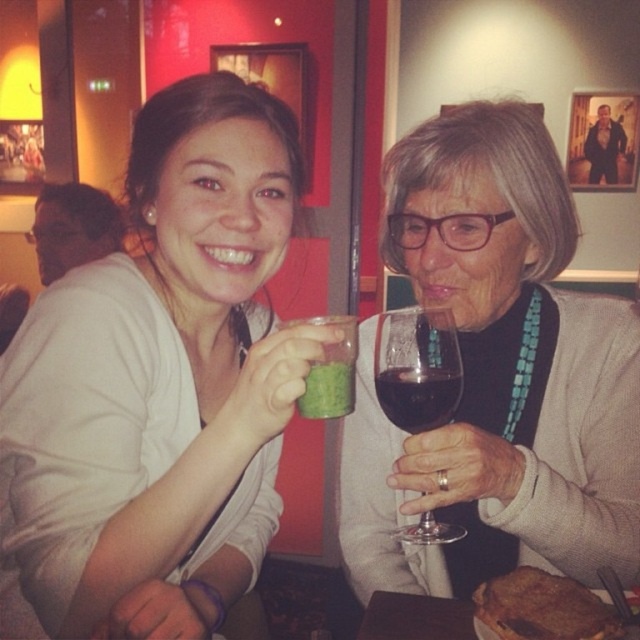
Question: Considering the real-world distances, which object is farthest from the wooden table at lower center?

Choices:
 (A) transparent glass at upper right
 (B) dark red glass at upper center
 (C) matte white shirt at center

Answer: (C)

Question: Which object appears farthest from the camera in this image?

Choices:
 (A) matte white shirt at center
 (B) dark red glass at upper center

Answer: (B)

Question: Can you confirm if brown crispy bread at lower right is bigger than wooden table at lower center?

Choices:
 (A) yes
 (B) no

Answer: (B)

Question: Among these objects, which one is farthest from the camera?

Choices:
 (A) matte white shirt at center
 (B) brown crispy bread at lower right
 (C) green matte cup at center

Answer: (C)

Question: Does matte black wine glass at center have a smaller size compared to dark red glass at upper center?

Choices:
 (A) yes
 (B) no

Answer: (B)

Question: Does brown crispy bread at lower right appear on the left side of dark red glass at upper center?

Choices:
 (A) no
 (B) yes

Answer: (A)